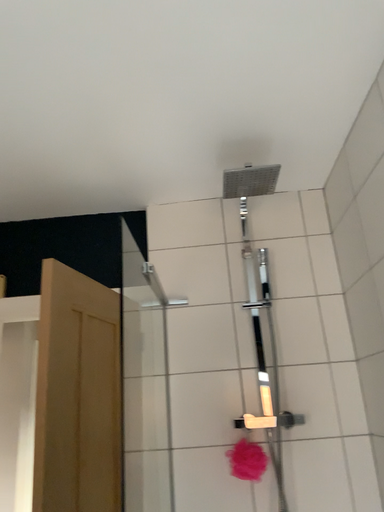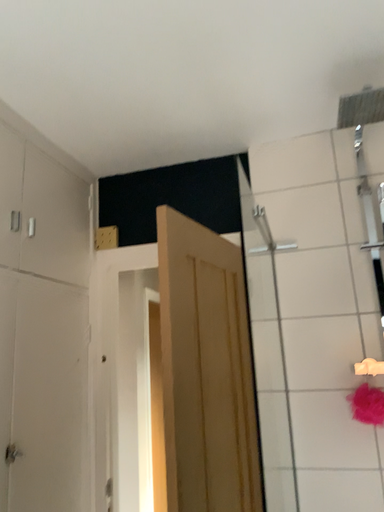
Question: Which way did the camera rotate in the video?

Choices:
 (A) rotated upward
 (B) rotated downward

Answer: (B)